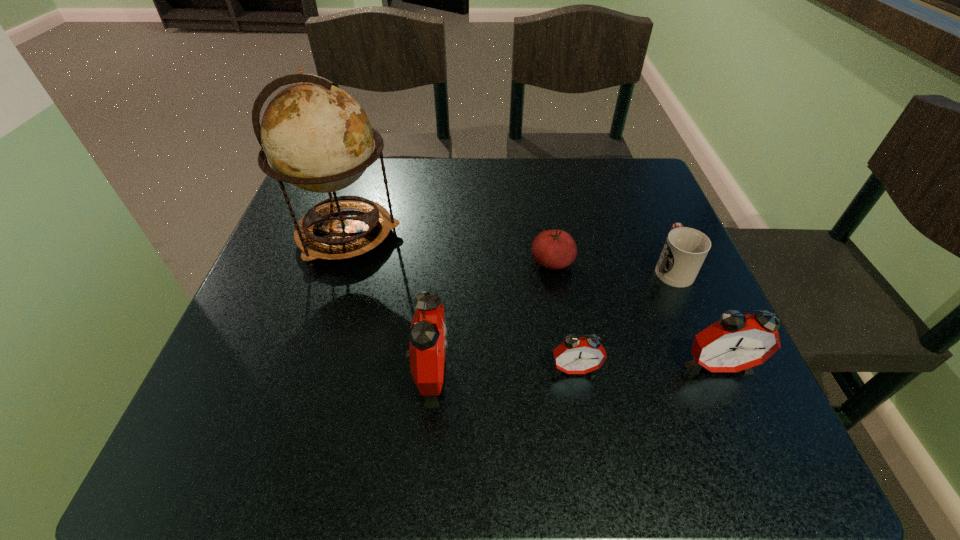
The height and width of the screenshot is (540, 960). I want to click on vacant area that lies between the fifth object from right to left and the tomato, so click(x=491, y=318).

Identify the location of free space that is in between the shortest alarm clock and the tomato. This screenshot has height=540, width=960. (564, 316).

Choose which object is the fifth nearest neighbor to the second alarm clock from left to right. Please provide its 2D coordinates. Your answer should be formatted as a tuple, i.e. [(x, y)], where the tuple contains the x and y coordinates of a point satisfying the conditions above.

[(317, 137)]

Identify which object is the fourth closest to the tomato. Please provide its 2D coordinates. Your answer should be formatted as a tuple, i.e. [(x, y)], where the tuple contains the x and y coordinates of a point satisfying the conditions above.

[(736, 342)]

Where is `the closest alarm clock to the tomato`? The image size is (960, 540). the closest alarm clock to the tomato is located at coordinates (575, 355).

Identify which alarm clock is the nearest to the tomato. Please provide its 2D coordinates. Your answer should be formatted as a tuple, i.e. [(x, y)], where the tuple contains the x and y coordinates of a point satisfying the conditions above.

[(575, 355)]

Identify the location of free location that satisfies the following two spatial constraints: 1. at the center of the tomato; 2. on the right side of the globe. (339, 262).

The height and width of the screenshot is (540, 960). Find the location of `vacant point that satisfies the following two spatial constraints: 1. on the clock face of the third tallest object; 2. on the clock face of the fifth object from right to left`. vacant point that satisfies the following two spatial constraints: 1. on the clock face of the third tallest object; 2. on the clock face of the fifth object from right to left is located at coordinates (721, 373).